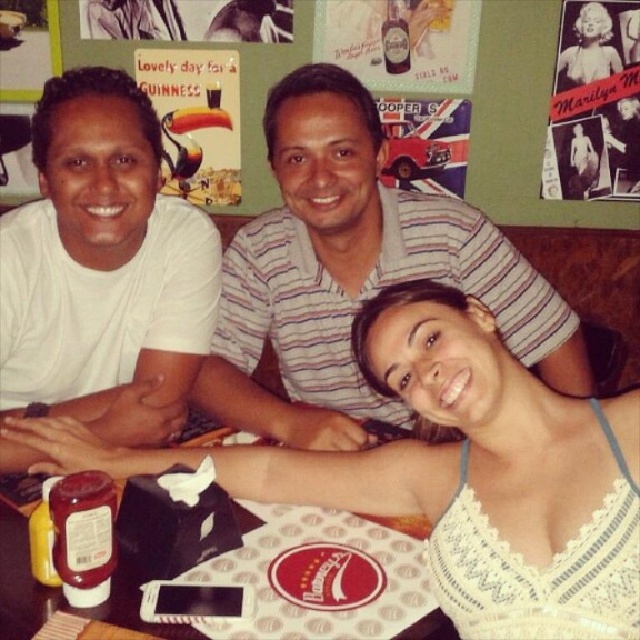
Question: Which object is the closest to the white matte shirt at upper left?

Choices:
 (A) vintage paper marilyn monroe poster at upper right
 (B) white striped shirt at center
 (C) white paper napkin at lower center
 (D) white lace tank top at center

Answer: (B)

Question: Does white striped shirt at center have a smaller size compared to white paper napkin at lower center?

Choices:
 (A) no
 (B) yes

Answer: (A)

Question: Is white paper napkin at lower center wider than vintage paper marilyn monroe poster at upper right?

Choices:
 (A) no
 (B) yes

Answer: (B)

Question: Can you confirm if white lace tank top at center is smaller than white paper napkin at lower center?

Choices:
 (A) no
 (B) yes

Answer: (A)

Question: Estimate the real-world distances between objects in this image. Which object is closer to the white paper napkin at lower center?

Choices:
 (A) vintage paper marilyn monroe poster at upper right
 (B) white striped shirt at center
 (C) white matte shirt at upper left

Answer: (C)

Question: Based on their relative distances, which object is farther from the white striped shirt at center?

Choices:
 (A) vintage paper marilyn monroe poster at upper right
 (B) white paper napkin at lower center
 (C) white matte shirt at upper left
 (D) white lace tank top at center

Answer: (A)